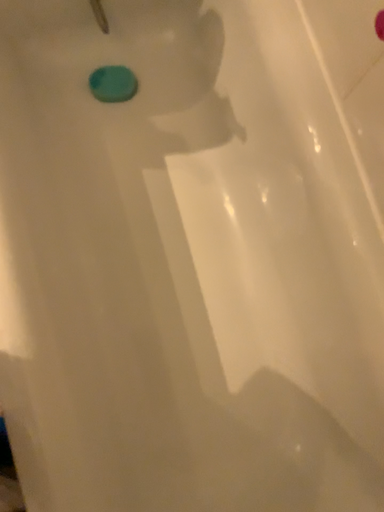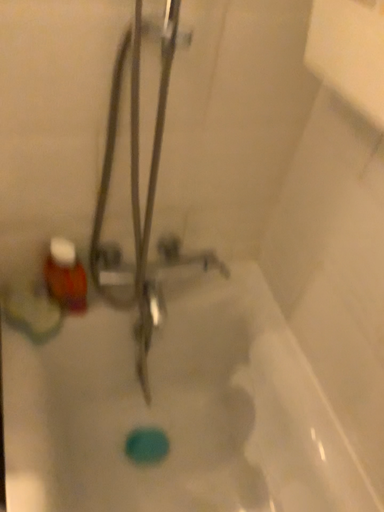
Question: Which way did the camera rotate in the video?

Choices:
 (A) rotated downward
 (B) rotated upward

Answer: (B)